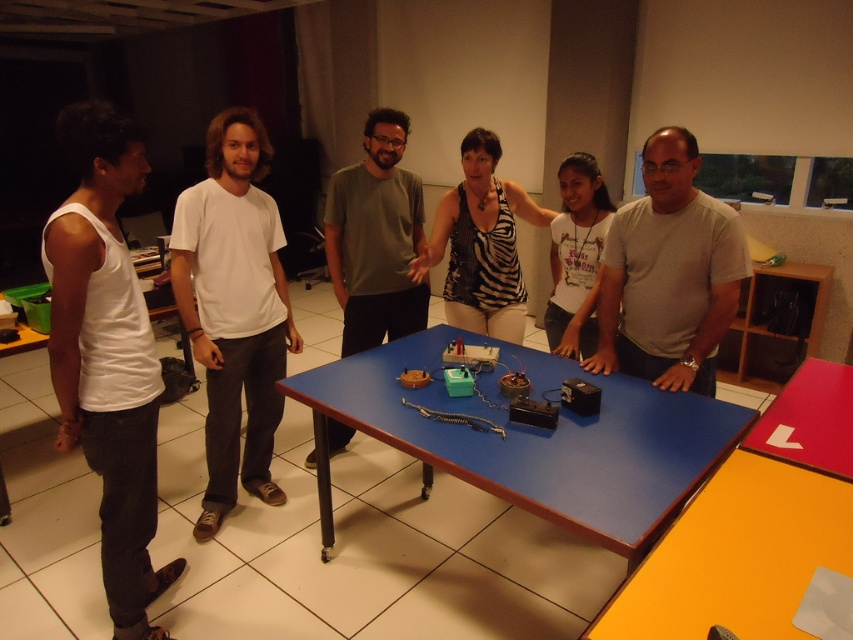
Question: Is white matte tank top at left behind white cotton t-shirt at left?

Choices:
 (A) yes
 (B) no

Answer: (B)

Question: Among these points, which one is nearest to the camera?

Choices:
 (A) (698, 564)
 (B) (573, 372)
 (C) (140, 417)

Answer: (A)

Question: Is gray matte shirt at center to the left of white cotton shirt at center from the viewer's perspective?

Choices:
 (A) no
 (B) yes

Answer: (B)

Question: Does white cotton t-shirt at left have a smaller size compared to yellow matte table at lower right?

Choices:
 (A) no
 (B) yes

Answer: (A)

Question: Which point is closer to the camera?

Choices:
 (A) zebra print tank top at center
 (B) gray matte shirt at center
 (C) smooth plastic table at lower right
 (D) blue plastic table at center

Answer: (D)

Question: Estimate the real-world distances between objects in this image. Which object is farther from the blue plastic table at center?

Choices:
 (A) gray matte shirt at center
 (B) white cotton shirt at center
 (C) yellow matte table at lower right
 (D) smooth plastic table at lower right

Answer: (A)